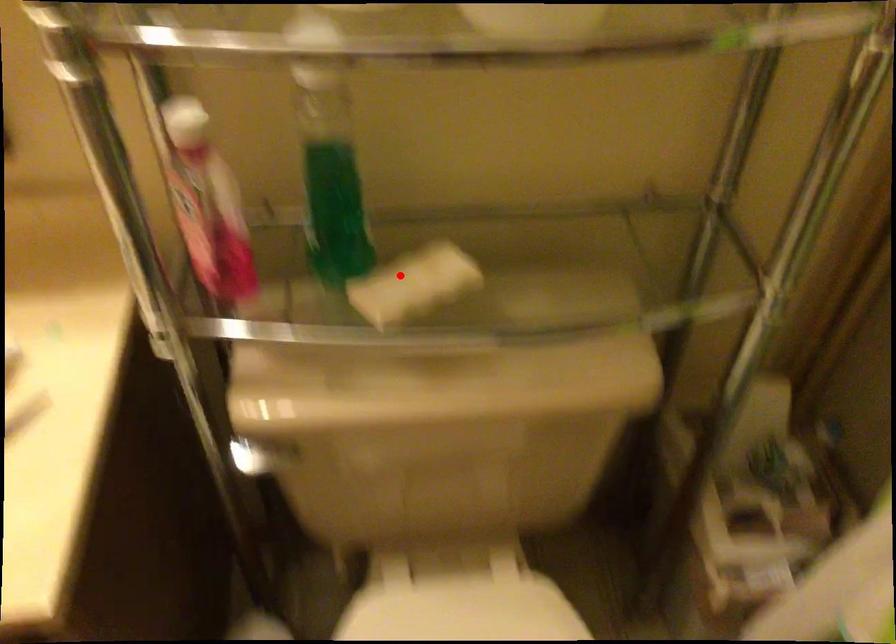
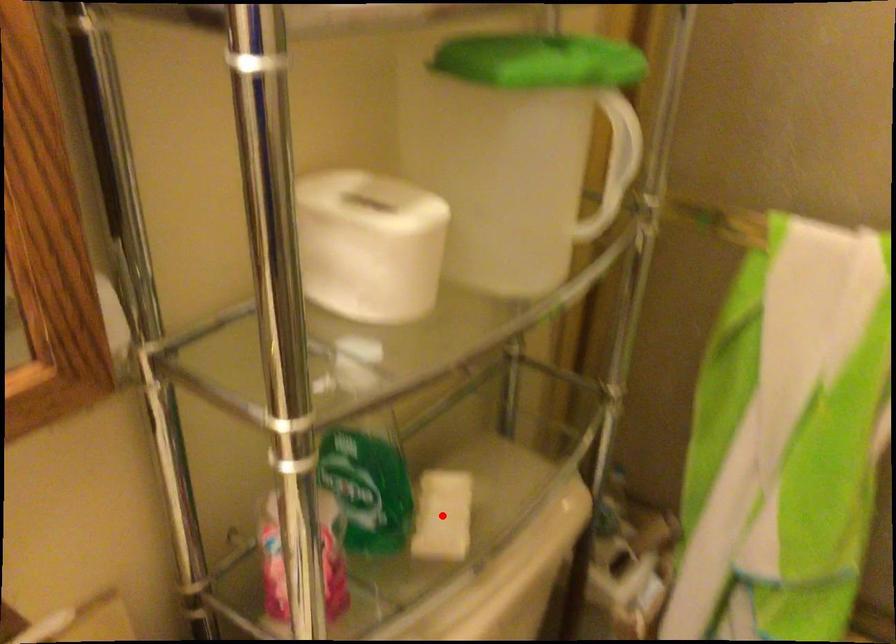
I am providing you with two images of the same scene from different viewpoints. A red point is marked on the first image and another point is marked on the second image. Are the points marked in image1 and image2 representing the same 3D position?

Yes